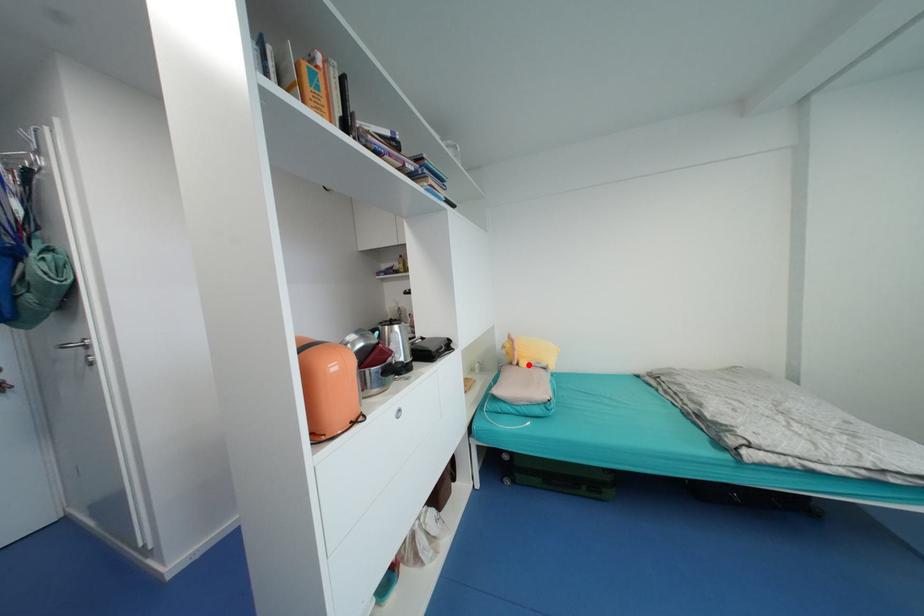
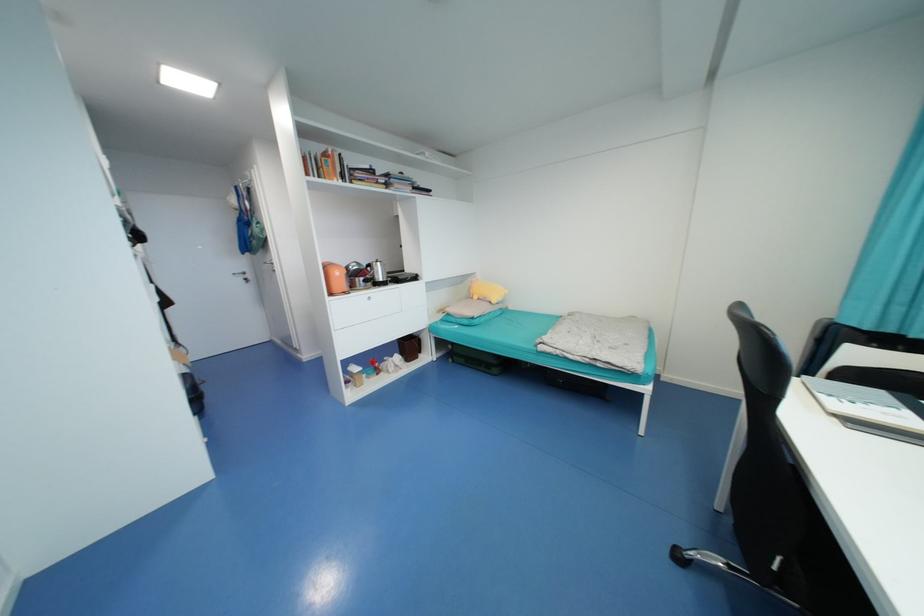
Question: I am providing you with two images of the same scene from different viewpoints. A red point is shown in image1. For the corresponding object point in image2, is it positioned nearer or farther from the camera?

Choices:
 (A) Nearer
 (B) Farther

Answer: (A)